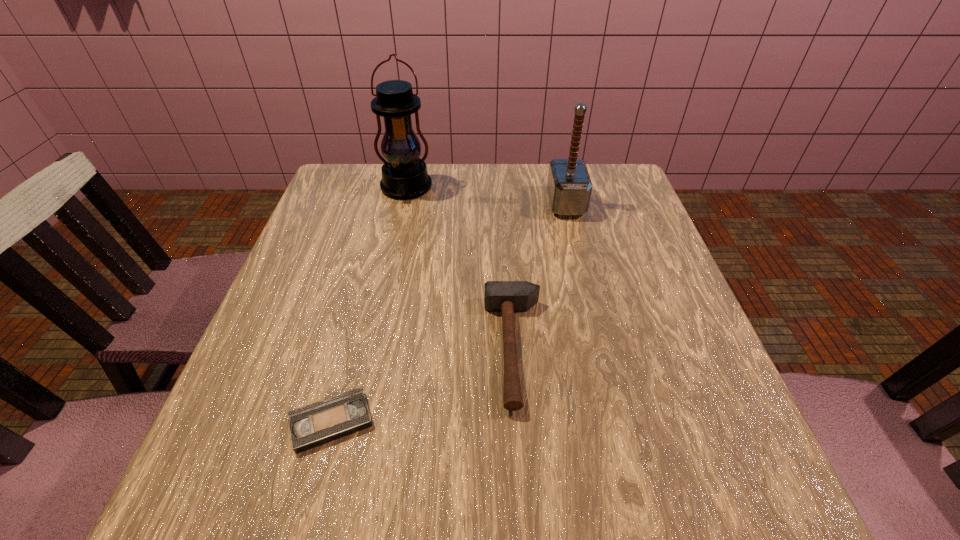
Identify the location of object present at the far right corner. This screenshot has width=960, height=540. (569, 186).

Image resolution: width=960 pixels, height=540 pixels. In the image, there is a desktop. Find the location of `vacant space at the far edge`. vacant space at the far edge is located at coordinates (461, 191).

Identify the location of free location at the near edge. (481, 507).

What are the coordinates of `blank area at the left edge` in the screenshot? It's located at (338, 281).

The width and height of the screenshot is (960, 540). What are the coordinates of `vacant space at the right edge` in the screenshot? It's located at (618, 271).

Locate an element on the screen. vacant space at the far left corner is located at coordinates (338, 188).

The height and width of the screenshot is (540, 960). In order to click on free space at the near left corner of the desktop in this screenshot , I will do `click(180, 500)`.

You are a GUI agent. You are given a task and a screenshot of the screen. Output one action in this format:
    pyautogui.click(x=<x>, y=<y>)
    Task: Click on the vacant space at the far right corner of the desktop
    The height and width of the screenshot is (540, 960).
    Given the screenshot: What is the action you would take?
    pyautogui.click(x=612, y=205)

At what (x,y) coordinates should I click in order to perform the action: click on free space at the near right corner. Please return your answer as a coordinate pair (x, y). Looking at the image, I should click on (745, 490).

Identify the location of empty space between the left hammer and the lantern. Image resolution: width=960 pixels, height=540 pixels. (461, 268).